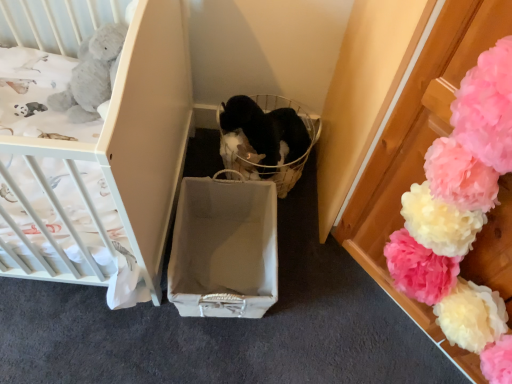
Question: Considering the relative positions of fluffy tissue paper pom-poms at right and black fabric basket at center in the image provided, is fluffy tissue paper pom-poms at right to the left of black fabric basket at center from the viewer's perspective?

Choices:
 (A) yes
 (B) no

Answer: (B)

Question: From a real-world perspective, is fluffy tissue paper pom-poms at right located beneath black fabric basket at center?

Choices:
 (A) no
 (B) yes

Answer: (A)

Question: From the image's perspective, is fluffy tissue paper pom-poms at right located above black fabric basket at center?

Choices:
 (A) no
 (B) yes

Answer: (A)

Question: Does fluffy tissue paper pom-poms at right have a larger size compared to black fabric basket at center?

Choices:
 (A) no
 (B) yes

Answer: (B)

Question: Is fluffy tissue paper pom-poms at right to the right of black fabric basket at center from the viewer's perspective?

Choices:
 (A) yes
 (B) no

Answer: (A)

Question: Considering the relative sizes of fluffy tissue paper pom-poms at right and black fabric basket at center in the image provided, is fluffy tissue paper pom-poms at right taller than black fabric basket at center?

Choices:
 (A) yes
 (B) no

Answer: (A)

Question: From a real-world perspective, is matte gray cardboard box at center below fluffy tissue paper pom-poms at right?

Choices:
 (A) yes
 (B) no

Answer: (A)

Question: Is matte gray cardboard box at center far away from fluffy tissue paper pom-poms at right?

Choices:
 (A) no
 (B) yes

Answer: (A)

Question: From the image's perspective, is matte gray cardboard box at center located above fluffy tissue paper pom-poms at right?

Choices:
 (A) yes
 (B) no

Answer: (B)

Question: Is fluffy tissue paper pom-poms at right inside matte gray cardboard box at center?

Choices:
 (A) yes
 (B) no

Answer: (B)

Question: Can you confirm if matte gray cardboard box at center is taller than fluffy tissue paper pom-poms at right?

Choices:
 (A) yes
 (B) no

Answer: (B)

Question: Is matte gray cardboard box at center smaller than fluffy tissue paper pom-poms at right?

Choices:
 (A) no
 (B) yes

Answer: (B)

Question: Considering the relative sizes of black fabric basket at center and fluffy tissue paper pom-poms at right in the image provided, is black fabric basket at center shorter than fluffy tissue paper pom-poms at right?

Choices:
 (A) no
 (B) yes

Answer: (B)